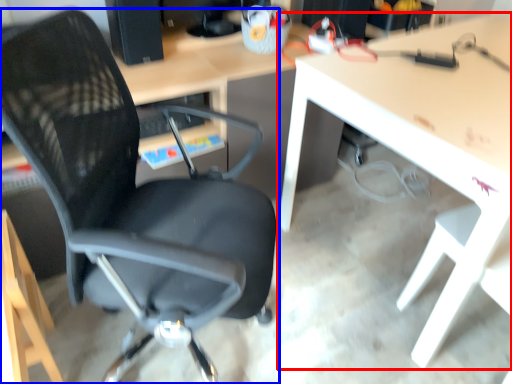
Question: Among these objects, which one is nearest to the camera, table (highlighted by a red box) or chair (highlighted by a blue box)?

Choices:
 (A) table
 (B) chair

Answer: (B)